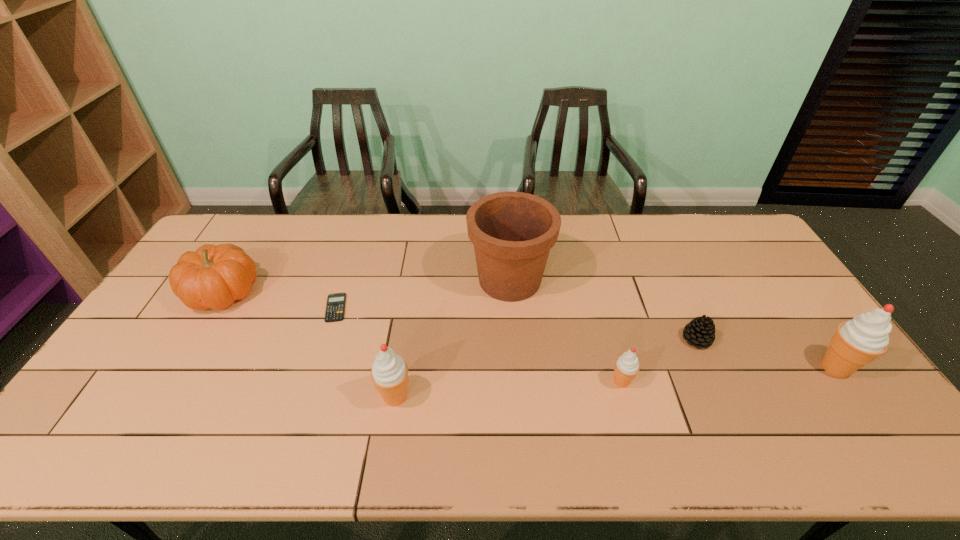
With all icecreams evenly spaced, where should an extra icecream be placed on the left to continue the pattern? Please point out a vacant space. Please provide its 2D coordinates. Your answer should be formatted as a tuple, i.e. [(x, y)], where the tuple contains the x and y coordinates of a point satisfying the conditions above.

[(156, 413)]